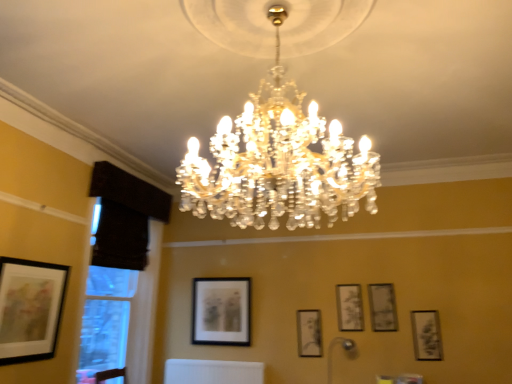
Question: Is matte black picture frame at center, the fifth picture frame in the right-to-left sequence, in front of matte black picture frame at upper right, marked as the 2th picture frame in a front-to-back arrangement?

Choices:
 (A) no
 (B) yes

Answer: (A)

Question: Is matte black picture frame at center, the second picture frame in the left-to-right sequence, oriented towards matte black picture frame at upper right, arranged as the 6th picture frame when viewed from the left?

Choices:
 (A) no
 (B) yes

Answer: (A)

Question: Is matte black picture frame at center, the fifth picture frame in the right-to-left sequence, at the right side of matte black picture frame at upper right, arranged as the 6th picture frame when viewed from the left?

Choices:
 (A) no
 (B) yes

Answer: (A)

Question: From the image's perspective, does matte black picture frame at center, the second picture frame in the left-to-right sequence, appear lower than matte black picture frame at upper right, which appears as the fifth picture frame when viewed from the back?

Choices:
 (A) yes
 (B) no

Answer: (B)

Question: From a real-world perspective, is matte black picture frame at center, the second picture frame in the left-to-right sequence, under matte black picture frame at upper right, arranged as the 6th picture frame when viewed from the left?

Choices:
 (A) yes
 (B) no

Answer: (B)

Question: Considering the positions of matte black picture frame at center, the sixth picture frame viewed from the front, and black fabric window at left in the image, is matte black picture frame at center, the sixth picture frame viewed from the front, bigger or smaller than black fabric window at left?

Choices:
 (A) big
 (B) small

Answer: (B)

Question: Is matte black picture frame at center, the 1th picture frame in the back-to-front sequence, taller or shorter than black fabric window at left?

Choices:
 (A) short
 (B) tall

Answer: (A)

Question: From a real-world perspective, is matte black picture frame at center, the sixth picture frame viewed from the front, positioned above or below black fabric window at left?

Choices:
 (A) above
 (B) below

Answer: (B)

Question: Is matte black picture frame at center, the 1th picture frame in the back-to-front sequence, spatially inside black fabric window at left, or outside of it?

Choices:
 (A) inside
 (B) outside

Answer: (B)

Question: From a real-world perspective, is matte black picture frame at upper right, which appears as the fifth picture frame when viewed from the back, physically located above or below matte black picture frame at upper right, the second picture frame from the right?

Choices:
 (A) above
 (B) below

Answer: (B)

Question: From their relative heights in the image, would you say matte black picture frame at upper right, marked as the 2th picture frame in a front-to-back arrangement, is taller or shorter than matte black picture frame at upper right, the fourth picture frame when ordered from back to front?

Choices:
 (A) tall
 (B) short

Answer: (A)

Question: From the image's perspective, is matte black picture frame at upper right, which is counted as the 1th picture frame, starting from the right, positioned above or below matte black picture frame at upper right, the fourth picture frame when ordered from back to front?

Choices:
 (A) below
 (B) above

Answer: (A)

Question: Would you say matte black picture frame at upper right, which is counted as the 1th picture frame, starting from the right, is inside or outside matte black picture frame at upper right, arranged as the 5th picture frame when viewed from the left?

Choices:
 (A) outside
 (B) inside

Answer: (A)

Question: In terms of width, does metallic silver lamp at lower center, acting as the 1th lamp starting from the right, look wider or thinner when compared to matte black picture frame at center, the 3th picture frame viewed from the left?

Choices:
 (A) thin
 (B) wide

Answer: (B)

Question: Visually, is metallic silver lamp at lower center, the second lamp positioned from the top, positioned to the left or to the right of matte black picture frame at center, the 5th picture frame positioned from the front?

Choices:
 (A) left
 (B) right

Answer: (B)